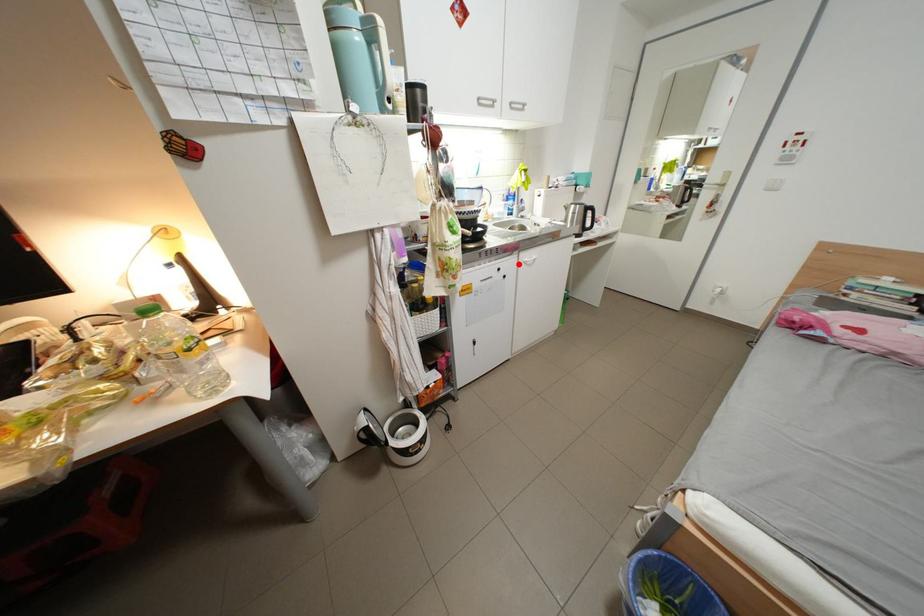
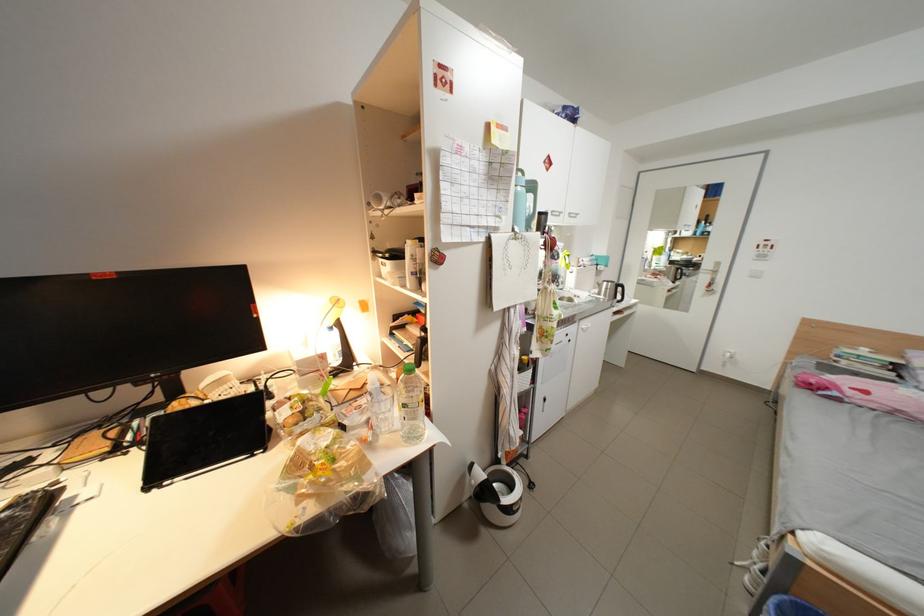
Question: I am providing you with two images of the same scene from different viewpoints. A red point is shown in image1. For the corresponding object point in image2, is it positioned nearer or farther from the camera?

Choices:
 (A) Nearer
 (B) Farther

Answer: (B)